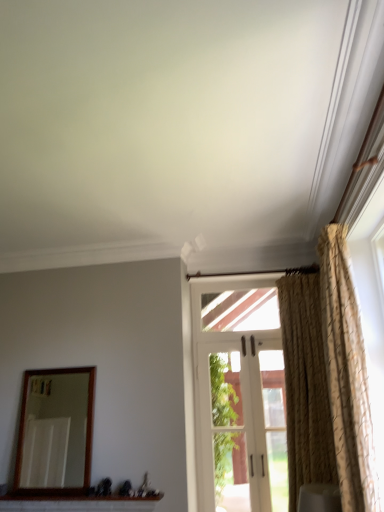
Question: Can you confirm if wooden-framed mirror at left is taller than white brick window sill at lower center?

Choices:
 (A) yes
 (B) no

Answer: (A)

Question: Considering the relative sizes of wooden-framed mirror at left and white brick window sill at lower center in the image provided, is wooden-framed mirror at left bigger than white brick window sill at lower center?

Choices:
 (A) no
 (B) yes

Answer: (B)

Question: Can you confirm if wooden-framed mirror at left is wider than white brick window sill at lower center?

Choices:
 (A) yes
 (B) no

Answer: (B)

Question: Does wooden-framed mirror at left have a smaller size compared to white brick window sill at lower center?

Choices:
 (A) no
 (B) yes

Answer: (A)

Question: Is wooden-framed mirror at left at the right side of white brick window sill at lower center?

Choices:
 (A) no
 (B) yes

Answer: (A)

Question: Is wooden-framed mirror at left shorter than white brick window sill at lower center?

Choices:
 (A) no
 (B) yes

Answer: (A)

Question: Considering the relative sizes of white fabric curtain at right and gold textured curtain at right, which appears as the 2th curtain when viewed from the back, in the image provided, is white fabric curtain at right smaller than gold textured curtain at right, which appears as the 2th curtain when viewed from the back,?

Choices:
 (A) yes
 (B) no

Answer: (A)

Question: From a real-world perspective, does white fabric curtain at right stand above gold textured curtain at right, which appears as the 2th curtain when viewed from the back?

Choices:
 (A) no
 (B) yes

Answer: (A)

Question: From the image's perspective, is white fabric curtain at right above gold textured curtain at right, which appears as the 2th curtain when viewed from the back?

Choices:
 (A) yes
 (B) no

Answer: (B)

Question: Can you confirm if white fabric curtain at right is wider than gold textured curtain at right, which appears as the 2th curtain when viewed from the back?

Choices:
 (A) no
 (B) yes

Answer: (B)

Question: Considering the relative positions of white fabric curtain at right and gold textured curtain at right, which appears as the 2th curtain when viewed from the back, in the image provided, is white fabric curtain at right to the right of gold textured curtain at right, which appears as the 2th curtain when viewed from the back, from the viewer's perspective?

Choices:
 (A) no
 (B) yes

Answer: (A)

Question: Considering the relative sizes of white fabric curtain at right and gold textured curtain at right, positioned as the 1th curtain in front-to-back order, in the image provided, is white fabric curtain at right thinner than gold textured curtain at right, positioned as the 1th curtain in front-to-back order,?

Choices:
 (A) yes
 (B) no

Answer: (B)

Question: Considering the relative sizes of white fabric curtain at right and beige textured curtain at right, which is the 2th curtain from front to back, in the image provided, is white fabric curtain at right wider than beige textured curtain at right, which is the 2th curtain from front to back,?

Choices:
 (A) yes
 (B) no

Answer: (B)